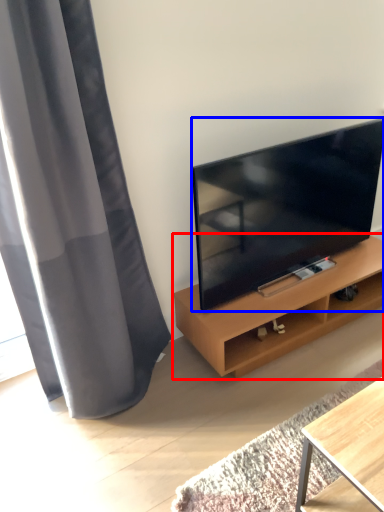
Question: Among these objects, which one is nearest to the camera, shelf (highlighted by a red box) or television (highlighted by a blue box)?

Choices:
 (A) shelf
 (B) television

Answer: (B)